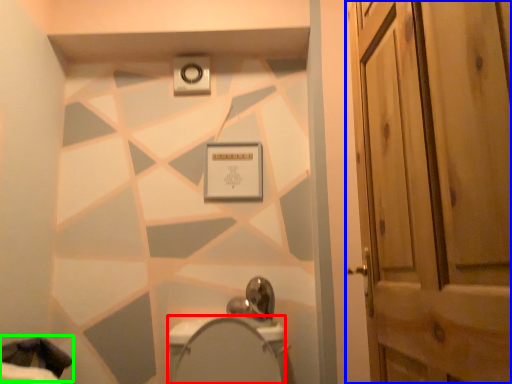
Question: Estimate the real-world distances between objects in this image. Which object is farther from bidet (highlighted by a red box), door (highlighted by a blue box) or laundry (highlighted by a green box)?

Choices:
 (A) door
 (B) laundry

Answer: (A)